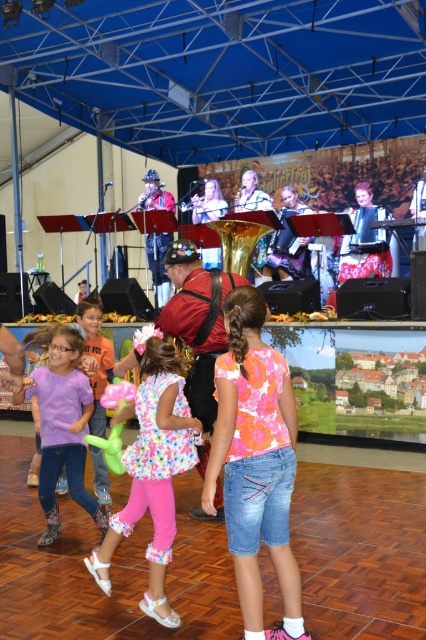
Question: Considering the real-world distances, which object is closest to the gold brass instrument at center?

Choices:
 (A) floral fabric dress at center
 (B) purple cotton shirt at lower left

Answer: (B)

Question: Estimate the real-world distances between objects in this image. Which object is closer to the floral fabric dress at center?

Choices:
 (A) gold brass instrument at center
 (B) floral cotton shirt at center
 (C) purple cotton shirt at lower left

Answer: (B)

Question: Is floral fabric dress at center bigger than gold brass instrument at center?

Choices:
 (A) yes
 (B) no

Answer: (A)

Question: Observing the image, what is the correct spatial positioning of floral fabric dress at center in reference to purple cotton shirt at lower left?

Choices:
 (A) right
 (B) left

Answer: (A)

Question: Which of these objects is positioned closest to the floral fabric dress at center?

Choices:
 (A) floral cotton shirt at center
 (B) gold brass instrument at center

Answer: (A)

Question: Can you confirm if purple cotton shirt at lower left is positioned above gold brass instrument at center?

Choices:
 (A) yes
 (B) no

Answer: (B)